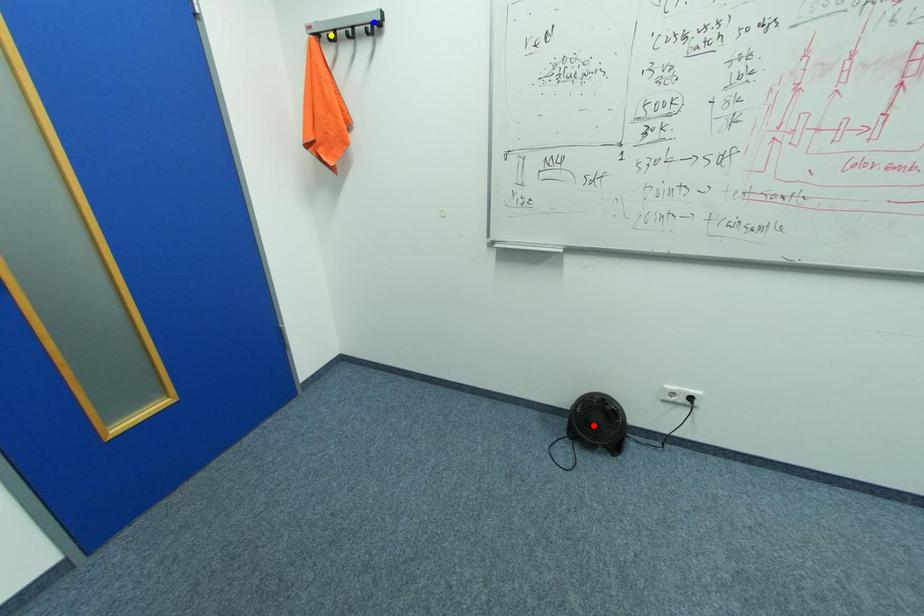
Order these from nearest to farthest:
- red point
- blue point
- yellow point

blue point < yellow point < red point